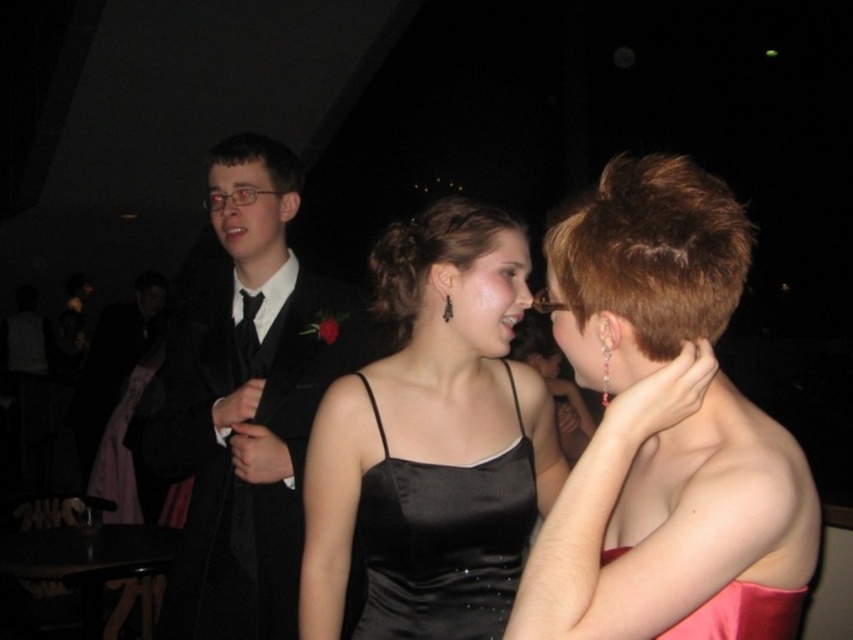
Does pink satin dress at center appear over satin black dress at center?

Yes, pink satin dress at center is above satin black dress at center.

Who is more forward, (x=587, y=595) or (x=410, y=221)?

Point (x=587, y=595) is more forward.

The height and width of the screenshot is (640, 853). What do you see at coordinates (662, 426) in the screenshot?
I see `pink satin dress at center` at bounding box center [662, 426].

I want to click on pink satin dress at center, so click(662, 426).

Can you confirm if black satin dress at center is positioned below black satin tie at center?

Yes, black satin dress at center is below black satin tie at center.

Who is more distant from viewer, (511, 502) or (242, 339)?

The point (242, 339) is behind.

I want to click on black satin dress at center, so click(x=444, y=541).

Does black satin suit at left have a lesser width compared to black satin tie at center?

In fact, black satin suit at left might be wider than black satin tie at center.

Is black satin suit at left further to the viewer compared to black satin tie at center?

No.

Does point (218, 220) lie in front of point (256, 337)?

No, (218, 220) is further to viewer.

The image size is (853, 640). I want to click on black satin suit at left, so click(242, 403).